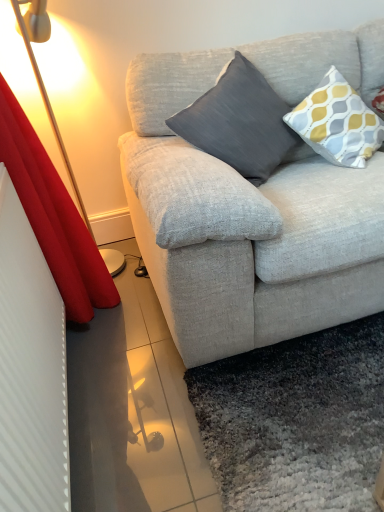
Question: Is red velvet curtain at left further to camera compared to dark gray fabric pillow at center, placed as the second pillow when sorted from right to left?

Choices:
 (A) no
 (B) yes

Answer: (A)

Question: Is red velvet curtain at left at the right side of dark gray fabric pillow at center, the 1th pillow positioned from the left?

Choices:
 (A) yes
 (B) no

Answer: (B)

Question: Is red velvet curtain at left directly adjacent to dark gray fabric pillow at center, placed as the second pillow when sorted from right to left?

Choices:
 (A) no
 (B) yes

Answer: (A)

Question: Does red velvet curtain at left turn towards dark gray fabric pillow at center, placed as the second pillow when sorted from right to left?

Choices:
 (A) yes
 (B) no

Answer: (A)

Question: Considering the relative sizes of red velvet curtain at left and dark gray fabric pillow at center, placed as the second pillow when sorted from right to left, in the image provided, is red velvet curtain at left thinner than dark gray fabric pillow at center, placed as the second pillow when sorted from right to left,?

Choices:
 (A) no
 (B) yes

Answer: (B)

Question: Can you confirm if red velvet curtain at left is smaller than dark gray fabric pillow at center, placed as the second pillow when sorted from right to left?

Choices:
 (A) no
 (B) yes

Answer: (A)

Question: Would you say red velvet curtain at left is part of dark gray fabric pillow at center, the 1th pillow positioned from the left,'s contents?

Choices:
 (A) yes
 (B) no

Answer: (B)

Question: From a real-world perspective, does dark gray fabric pillow at center, the 1th pillow positioned from the left, sit lower than red velvet curtain at left?

Choices:
 (A) no
 (B) yes

Answer: (A)

Question: From the image's perspective, does dark gray fabric pillow at center, the 1th pillow positioned from the left, appear higher than red velvet curtain at left?

Choices:
 (A) no
 (B) yes

Answer: (B)

Question: Is dark gray fabric pillow at center, the 1th pillow positioned from the left, beside red velvet curtain at left?

Choices:
 (A) no
 (B) yes

Answer: (A)

Question: From the image's perspective, is dark gray fabric pillow at center, placed as the second pillow when sorted from right to left, located beneath red velvet curtain at left?

Choices:
 (A) yes
 (B) no

Answer: (B)

Question: Considering the relative sizes of dark gray fabric pillow at center, the 1th pillow positioned from the left, and red velvet curtain at left in the image provided, is dark gray fabric pillow at center, the 1th pillow positioned from the left, taller than red velvet curtain at left?

Choices:
 (A) yes
 (B) no

Answer: (B)

Question: Is red velvet curtain at left further to camera compared to yellow and gray patterned pillow at upper right, the 2th pillow viewed from the left?

Choices:
 (A) no
 (B) yes

Answer: (A)